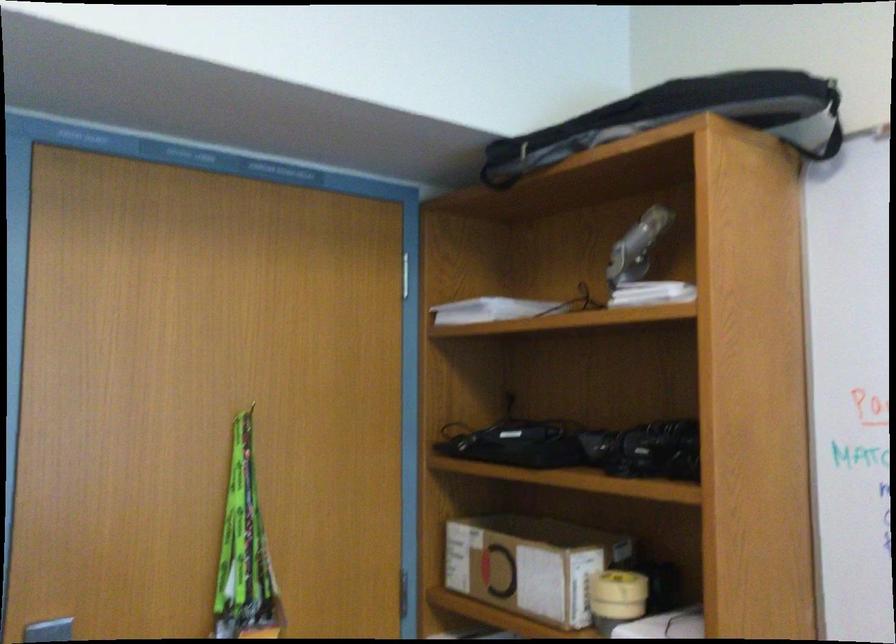
Which object does [530,564] point to?

It refers to a cardboard box.